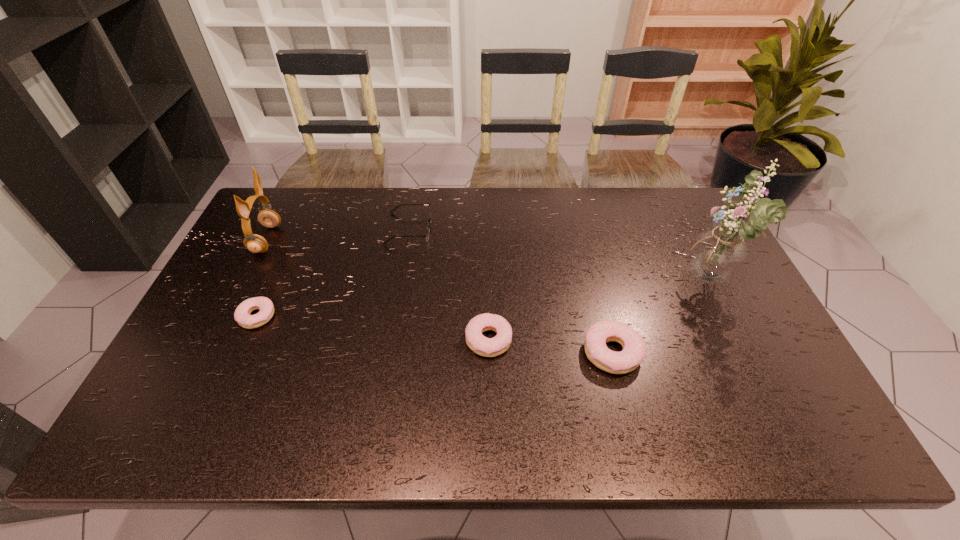
This screenshot has width=960, height=540. In order to click on vacant space at the far right corner in this screenshot , I will do `click(667, 191)`.

Locate an element on the screen. Image resolution: width=960 pixels, height=540 pixels. free space at the near right corner is located at coordinates (775, 388).

In order to click on free space between the second doughnut from right to left and the tallest object in this screenshot , I will do tap(599, 311).

Locate an element on the screen. The image size is (960, 540). free spot between the shortest doughnut and the fourth shortest object is located at coordinates (435, 334).

Identify the location of free spot between the fourth object from left to right and the leftmost doughnut. The width and height of the screenshot is (960, 540). pos(372,328).

Locate an element on the screen. Image resolution: width=960 pixels, height=540 pixels. free area in between the second doughnut from left to right and the rightmost object is located at coordinates (599, 311).

At what (x,y) coordinates should I click in order to perform the action: click on free space between the shortest doughnut and the fourth object from right to left. Please return your answer as a coordinate pair (x, y). This screenshot has height=540, width=960. Looking at the image, I should click on (333, 273).

The image size is (960, 540). I want to click on free space between the earphone and the rightmost doughnut, so click(440, 296).

The height and width of the screenshot is (540, 960). Identify the location of free space between the fourth object from left to right and the bouquet. (599, 311).

This screenshot has width=960, height=540. I want to click on blank region between the earphone and the second tallest doughnut, so click(x=377, y=289).